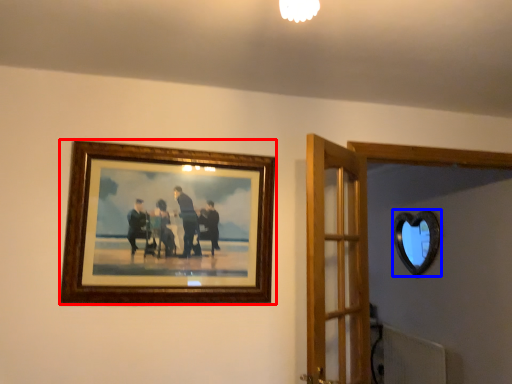
Question: Which of the following is the farthest to the observer, picture frame (highlighted by a red box) or mirror (highlighted by a blue box)?

Choices:
 (A) picture frame
 (B) mirror

Answer: (B)